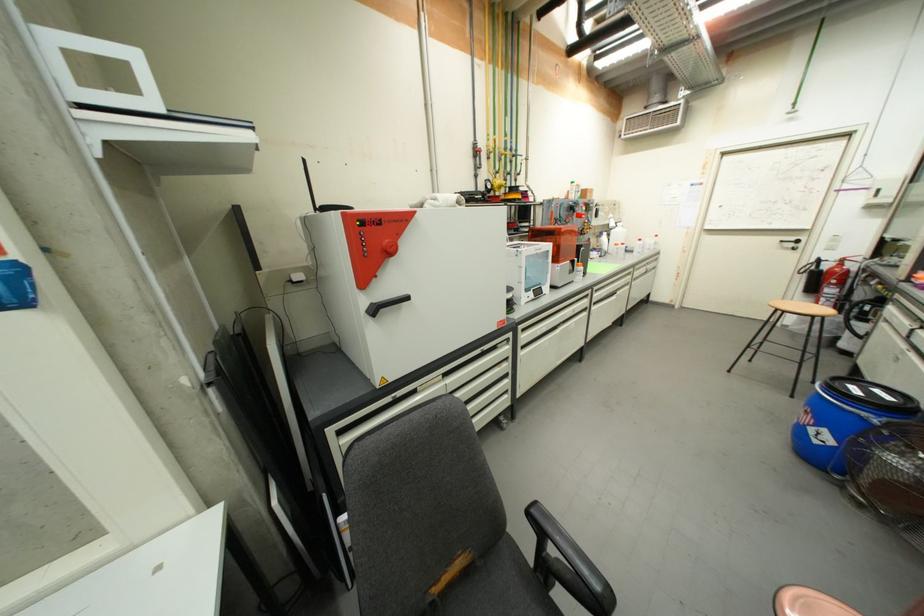
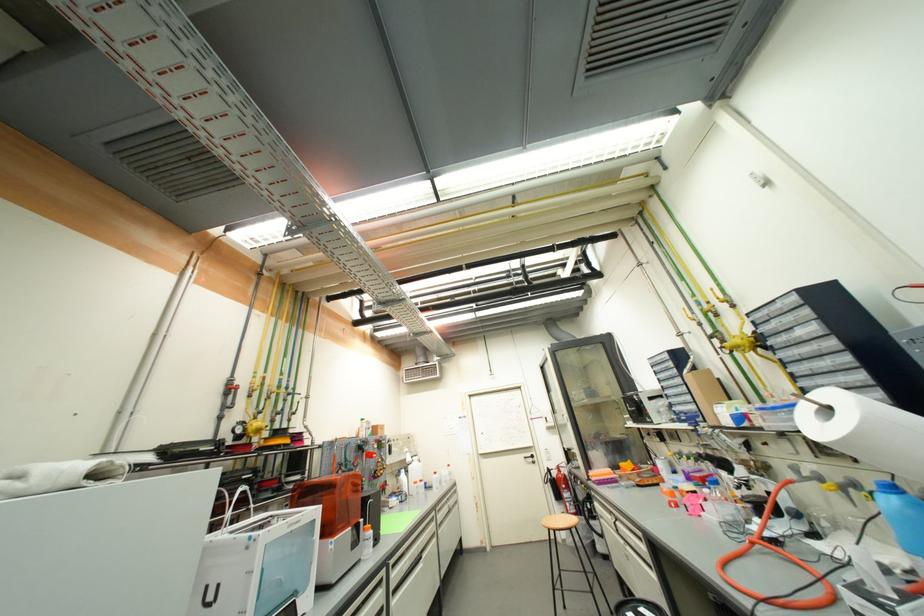
The point at (614, 225) is marked in the first image. Where is the corresponding point in the second image?

(410, 461)